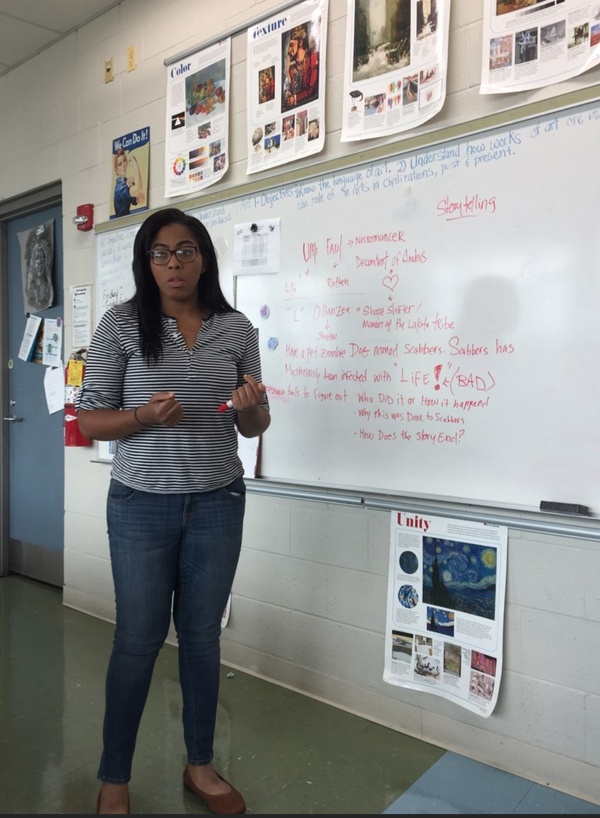
At what (x,y) coordinates should I click in order to perform the action: click on white brick wall. Please return your answer as a coordinate pair (x, y). Looking at the image, I should click on (318, 541).